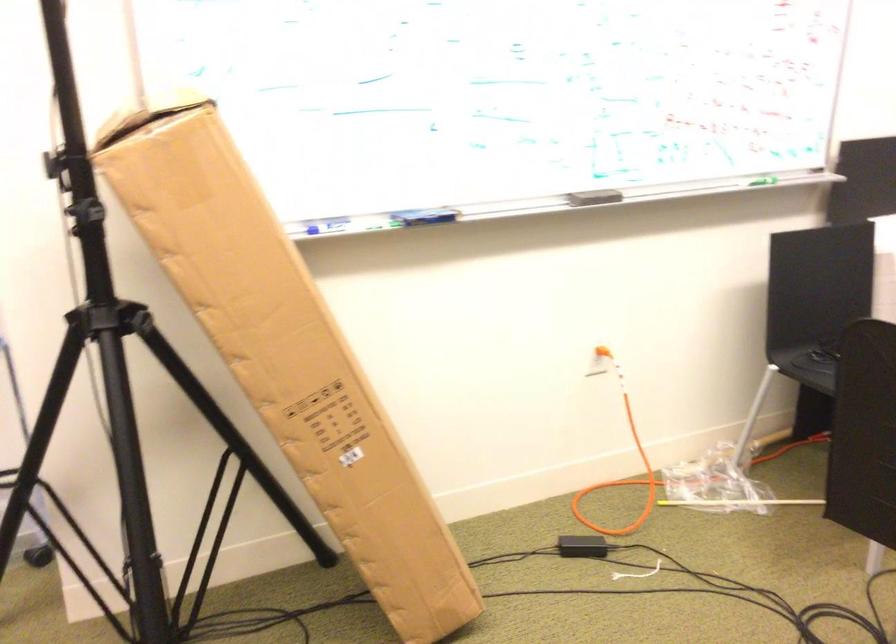
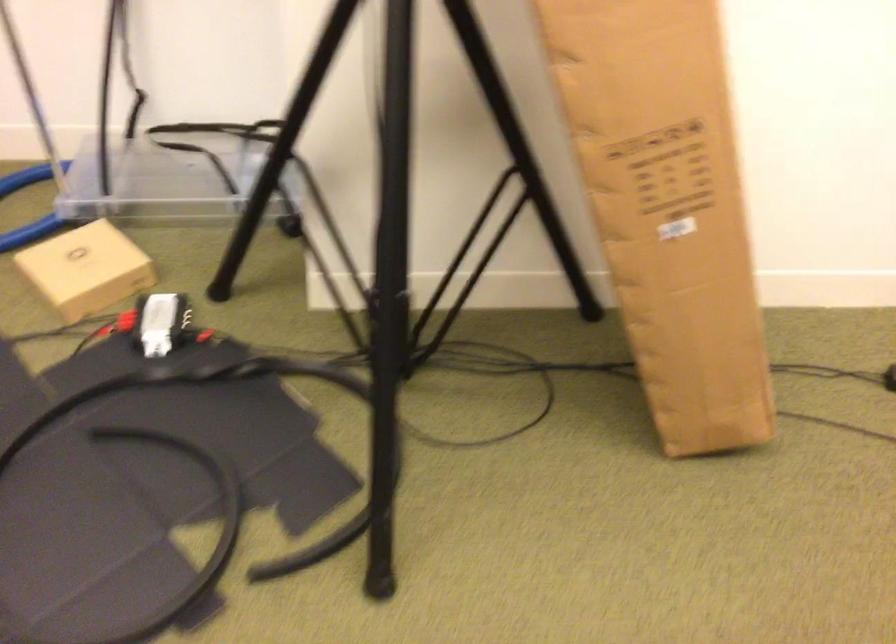
How did the camera likely rotate?

The camera's rotation is toward left-down.